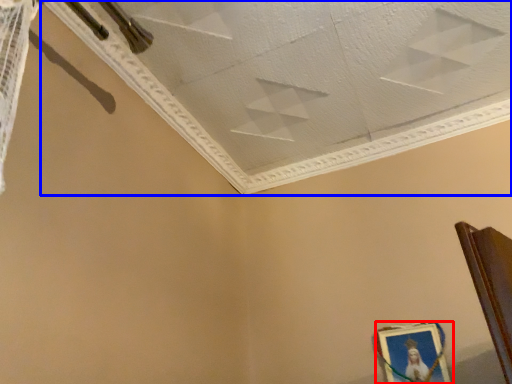
Question: Which point is closer to the camera, picture frame (highlighted by a red box) or wide (highlighted by a blue box)?

Choices:
 (A) picture frame
 (B) wide

Answer: (B)